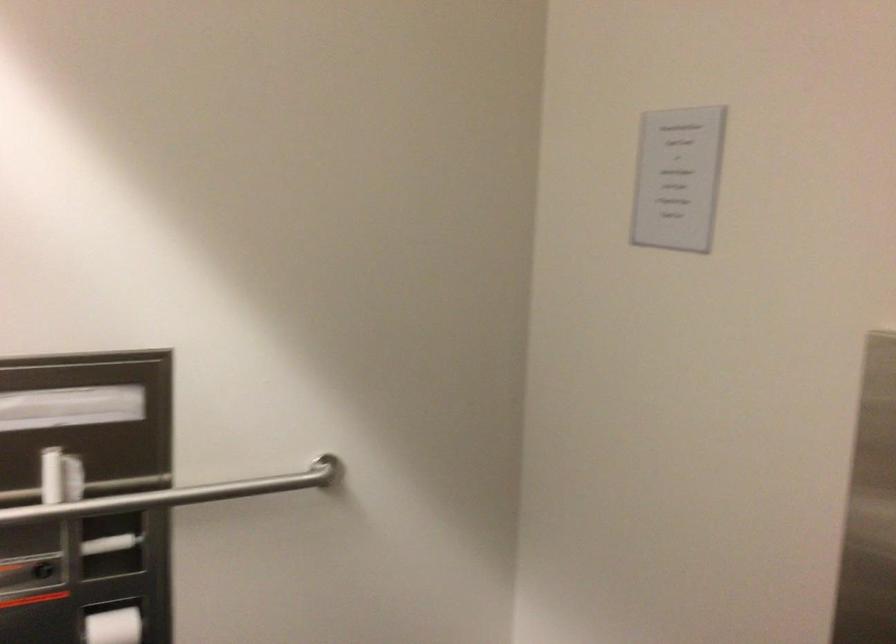
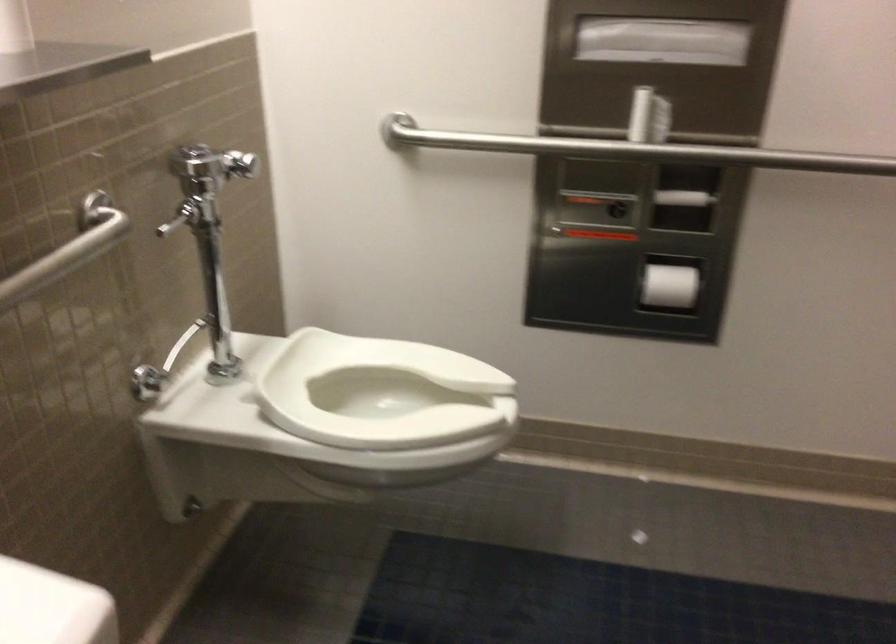
In the second image, find the point that corresponds to pixel 122 541 in the first image.

(683, 198)